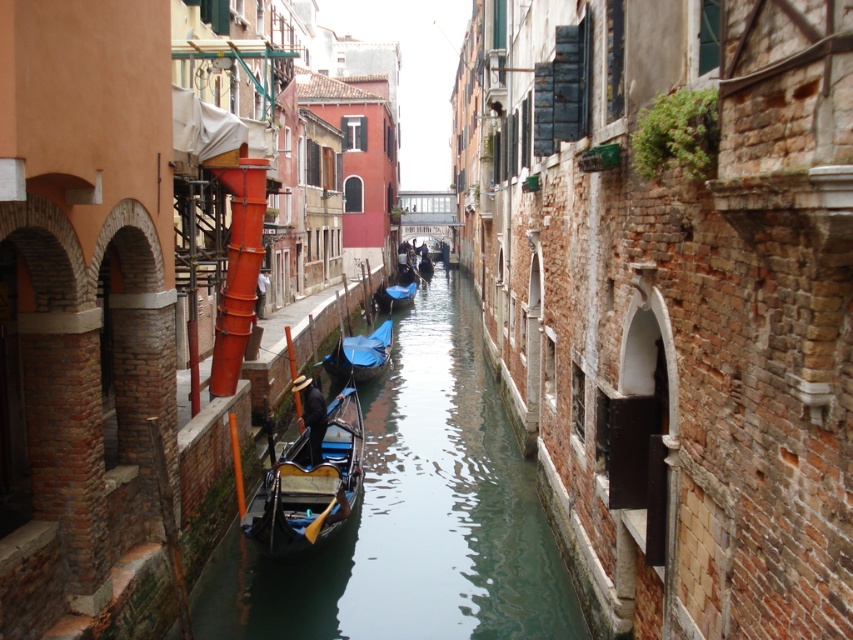
Question: Which object is farther from the camera taking this photo?

Choices:
 (A) blue glossy gondola at center
 (B) wooden gondola at center
 (C) smooth dark blue water at center
 (D) blue fabric boat at center

Answer: (D)

Question: Considering the real-world distances, which object is closest to the smooth dark blue water at center?

Choices:
 (A) wooden gondola at center
 (B) blue glossy gondola at center
 (C) blue fabric boat at center

Answer: (B)

Question: Is smooth dark blue water at center closer to camera compared to blue glossy gondola at center?

Choices:
 (A) no
 (B) yes

Answer: (B)

Question: Does smooth dark blue water at center appear over blue glossy gondola at center?

Choices:
 (A) no
 (B) yes

Answer: (A)

Question: Based on their relative distances, which object is nearer to the wooden gondola at center?

Choices:
 (A) blue glossy gondola at center
 (B) blue fabric boat at center
 (C) smooth dark blue water at center

Answer: (C)

Question: Can you confirm if smooth dark blue water at center is bigger than wooden gondola at center?

Choices:
 (A) yes
 (B) no

Answer: (A)